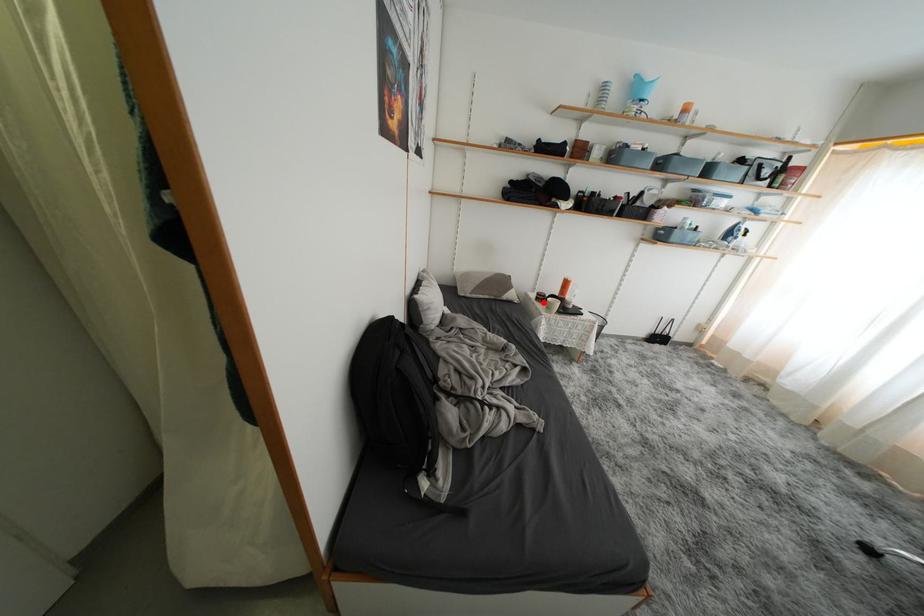
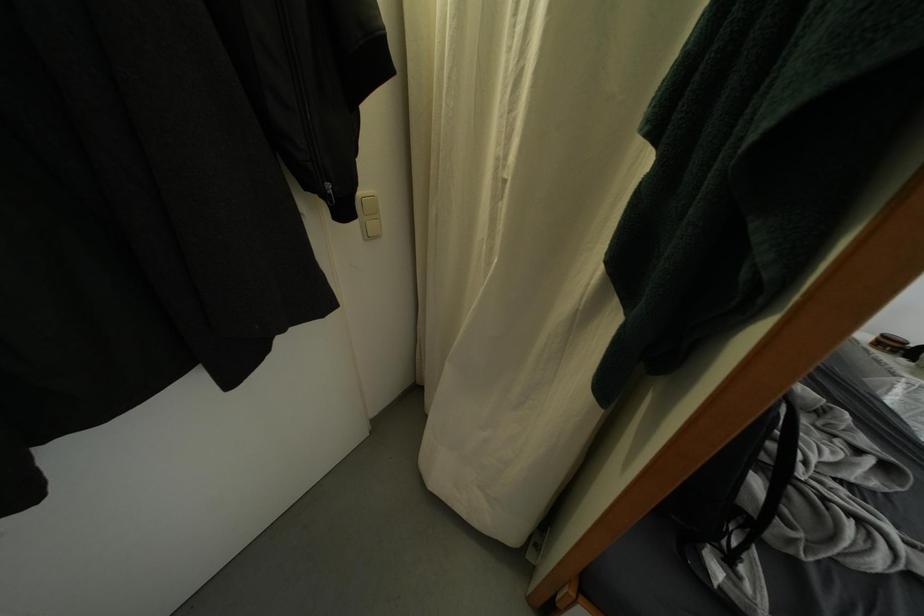
Question: I am providing you with two images of the same scene from different viewpoints. A red point is shown in image1. For the corresponding object point in image2, is it positioned nearer or farther from the camera?

Choices:
 (A) Nearer
 (B) Farther

Answer: (B)